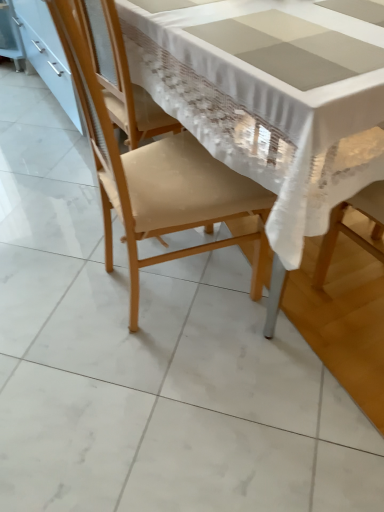
The image size is (384, 512). What are the coordinates of `space that is in front of matte beige chair at center` in the screenshot? It's located at click(x=173, y=384).